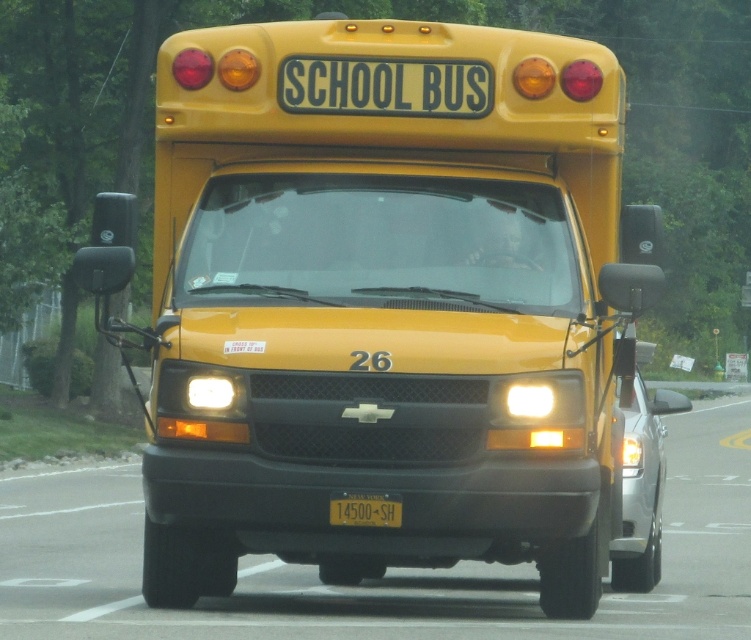
Can you confirm if yellow matte/solid school bus at center is positioned below yellow matte license plate at center?

No.

Between point (617, 96) and point (374, 496), which one is positioned in front?

Point (374, 496) is in front.

Describe the element at coordinates (388, 304) in the screenshot. I see `yellow matte/solid school bus at center` at that location.

This screenshot has height=640, width=751. Find the location of `yellow matte/solid school bus at center`. yellow matte/solid school bus at center is located at coordinates (388, 304).